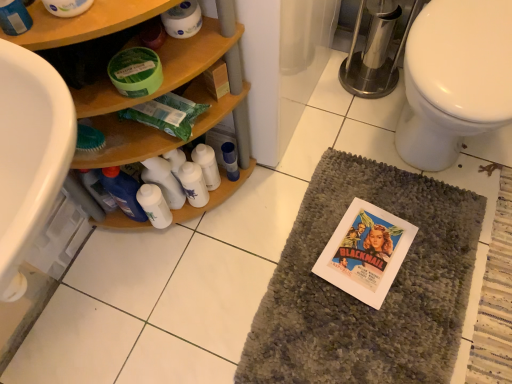
Find the location of `spots to the right of white matte lotion at center, marked as the 1th toiletry in a left-to-right arrangement`. spots to the right of white matte lotion at center, marked as the 1th toiletry in a left-to-right arrangement is located at coordinates (218, 232).